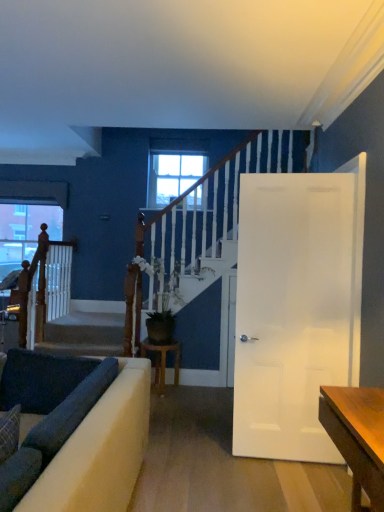
This screenshot has height=512, width=384. Find the location of `free point below white glossy door at right (from a real-world perspective)`. free point below white glossy door at right (from a real-world perspective) is located at coordinates (279, 462).